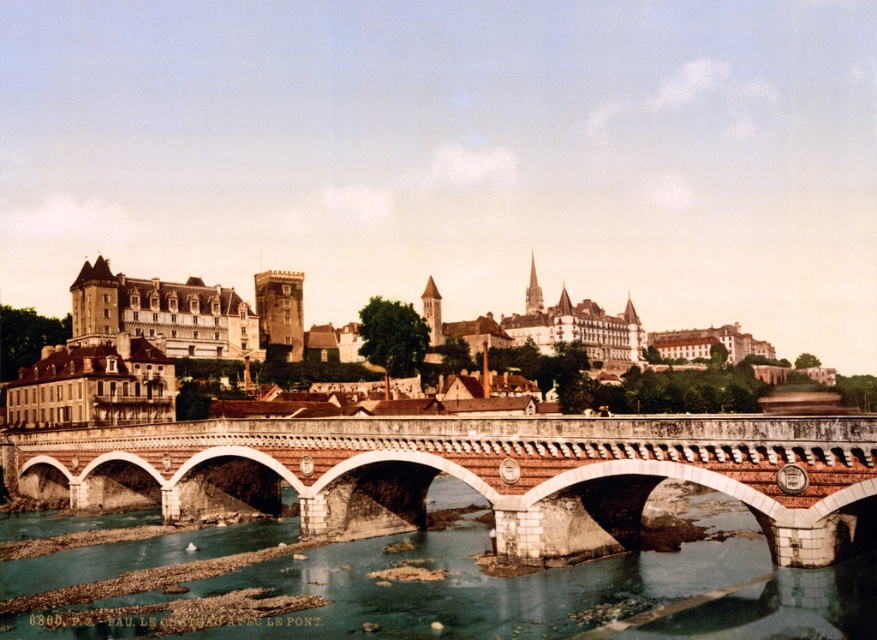
Question: Which object is positioned closest to the clear water at bridge center?

Choices:
 (A) matte stone building at center
 (B) brick stone bridge at center

Answer: (B)

Question: Can you confirm if clear water at bridge center is bigger than matte stone building at center?

Choices:
 (A) yes
 (B) no

Answer: (B)

Question: Does brick stone bridge at center appear on the left side of matte stone building at center?

Choices:
 (A) yes
 (B) no

Answer: (A)

Question: Can you confirm if brick stone bridge at center is positioned below matte stone building at center?

Choices:
 (A) yes
 (B) no

Answer: (A)

Question: Among these points, which one is farthest from the camera?

Choices:
 (A) (236, 480)
 (B) (571, 605)

Answer: (A)

Question: Which object is the farthest from the matte stone building at center?

Choices:
 (A) brick stone bridge at center
 (B) clear water at bridge center

Answer: (B)